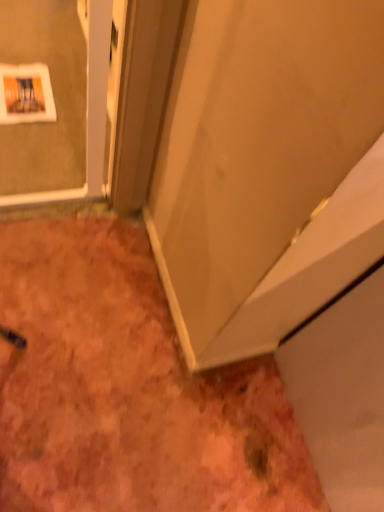
Question: Is matte white door at center far away from brown textured carpet at lower left?

Choices:
 (A) yes
 (B) no

Answer: (B)

Question: Is matte white door at center beside brown textured carpet at lower left?

Choices:
 (A) yes
 (B) no

Answer: (B)

Question: Can you confirm if matte white door at center is bigger than brown textured carpet at lower left?

Choices:
 (A) yes
 (B) no

Answer: (B)

Question: Can you confirm if matte white door at center is thinner than brown textured carpet at lower left?

Choices:
 (A) yes
 (B) no

Answer: (A)

Question: Considering the relative sizes of matte white door at center and brown textured carpet at lower left in the image provided, is matte white door at center smaller than brown textured carpet at lower left?

Choices:
 (A) yes
 (B) no

Answer: (A)

Question: Is matte white door at center behind brown textured carpet at lower left?

Choices:
 (A) yes
 (B) no

Answer: (B)

Question: Can you confirm if brown textured carpet at lower left is taller than matte white door at center?

Choices:
 (A) yes
 (B) no

Answer: (B)

Question: Can you confirm if brown textured carpet at lower left is shorter than matte white door at center?

Choices:
 (A) no
 (B) yes

Answer: (B)

Question: Is matte white door at center at the back of brown textured carpet at lower left?

Choices:
 (A) yes
 (B) no

Answer: (B)

Question: Is brown textured carpet at lower left behind matte white door at center?

Choices:
 (A) yes
 (B) no

Answer: (A)

Question: From a real-world perspective, does brown textured carpet at lower left sit lower than matte white door at center?

Choices:
 (A) yes
 (B) no

Answer: (A)

Question: From the image's perspective, does brown textured carpet at lower left appear higher than matte white door at center?

Choices:
 (A) no
 (B) yes

Answer: (A)

Question: Does point (157, 356) appear closer or farther from the camera than point (165, 145)?

Choices:
 (A) closer
 (B) farther

Answer: (B)